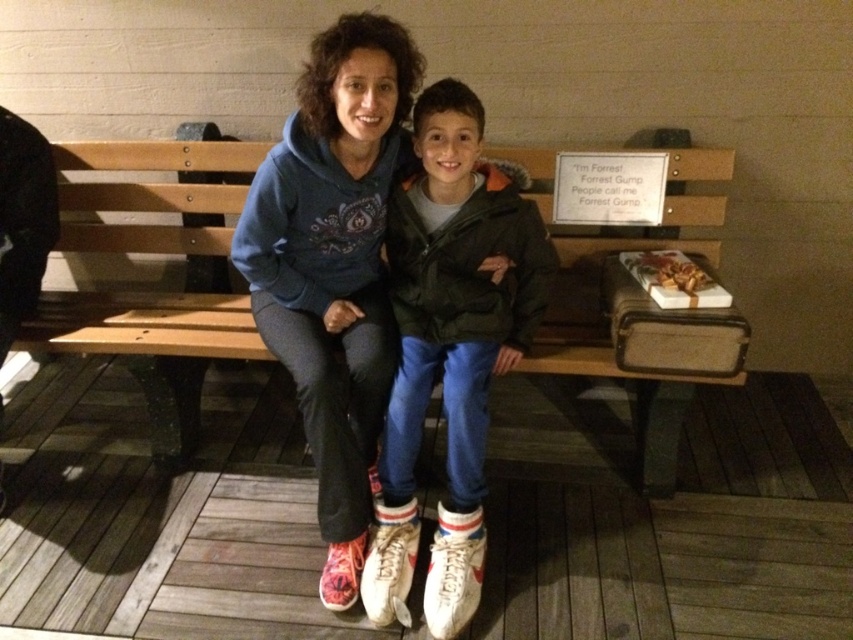
You are a delivery robot with a box that is 2 meters long. You need to place the box on the ground near the wooden bench at center. Is there enough space between you and the bench to safely place the box without it overlapping?

The distance between the wooden bench at center and the camera is 1.92 meters. Since the box is 2 meters long, placing it between you and the bench would require at least 2 meters of space. However, the available space is only 1.92 meters, so the box would overlap with either the bench or your position. Therefore, there isn not enough space to safely place the box without overlapping.

You are a tailor who needs to determine if the matte blue hoodie at center can fit into a storage box designed for items no wider than the white leather shoes at center. Based on the scene, can the hoodie fit?

The matte blue hoodie at center is wider than the white leather shoes at center, so it cannot fit into the storage box designed for items no wider than the white leather shoes at center.

You are standing at the origin point of the coordinate system. You see a point at coordinate (334, 266). What object is located at that point?

The object located at point (334, 266) is the matte blue hoodie at center.